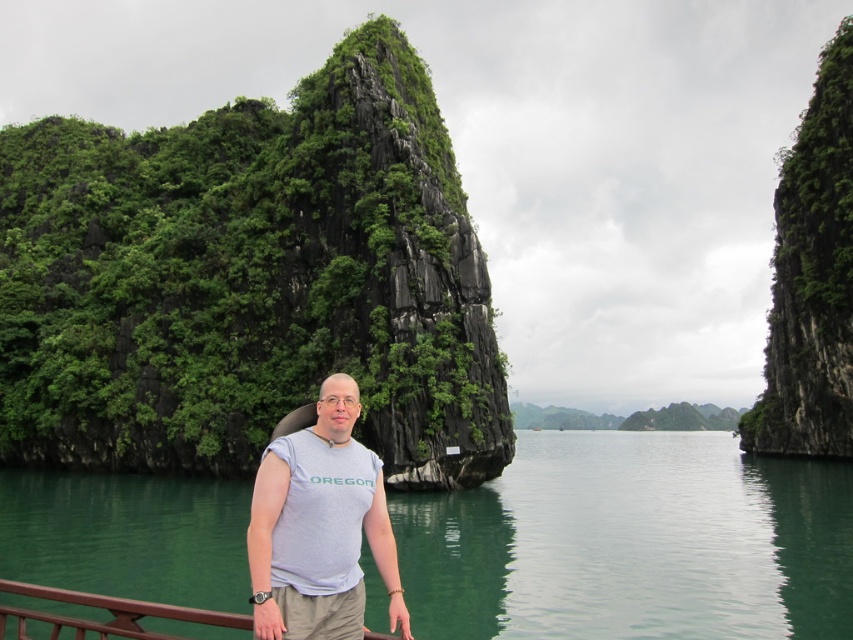
Question: Considering the relative positions of green liquid water at center and brown wood at lower left in the image provided, where is green liquid water at center located with respect to brown wood at lower left?

Choices:
 (A) left
 (B) right

Answer: (B)

Question: Does green liquid water at center lie behind brown wood at lower left?

Choices:
 (A) yes
 (B) no

Answer: (A)

Question: Which object appears farthest from the camera in this image?

Choices:
 (A) gray cotton t-shirt at center
 (B) green liquid water at center
 (C) green lichen-covered rock at center
 (D) brown wood at lower left

Answer: (C)

Question: Which point is farther to the camera?

Choices:
 (A) green liquid water at center
 (B) brown wood at lower left

Answer: (A)

Question: Does gray cotton t-shirt at center appear on the right side of brown wood at lower left?

Choices:
 (A) no
 (B) yes

Answer: (B)

Question: Among these objects, which one is farthest from the camera?

Choices:
 (A) green lichen-covered rock at center
 (B) green liquid water at center

Answer: (A)